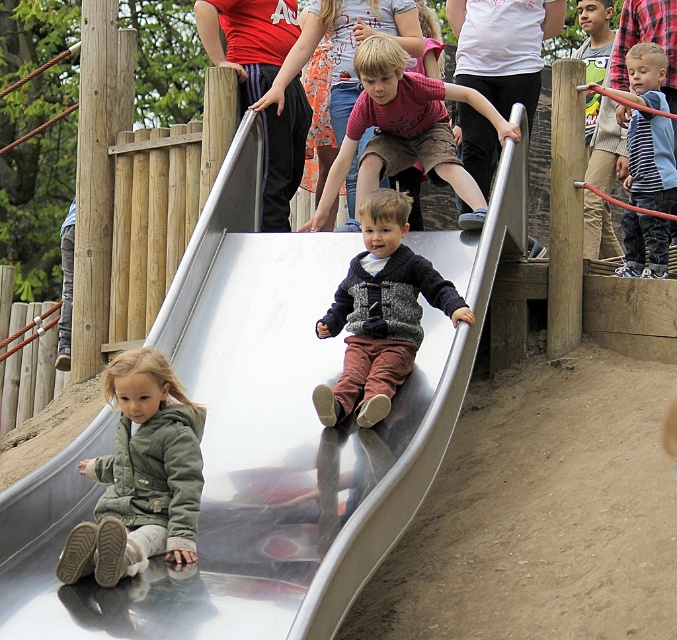
Which is in front, point (175, 496) or point (327, 392)?

Point (175, 496) is more forward.

Between green fleece jacket at lower left and knitted sweater at center, which one is positioned lower?

green fleece jacket at lower left is below.

The width and height of the screenshot is (677, 640). What are the coordinates of `green fleece jacket at lower left` in the screenshot? It's located at (139, 476).

Between metallic smooth slide at center and knitted sweater at center, which one has less height?

knitted sweater at center is shorter.

Who is more forward, (202, 545) or (374, 388)?

Point (202, 545) is more forward.

In order to click on metallic smooth slide at center in this screenshot , I will do `click(263, 435)`.

Is metallic smooth slide at center thinner than green fleece jacket at lower left?

No, metallic smooth slide at center is not thinner than green fleece jacket at lower left.

Is metallic smooth slide at center to the right of green fleece jacket at lower left from the viewer's perspective?

Yes, metallic smooth slide at center is to the right of green fleece jacket at lower left.

Locate an element on the screen. The height and width of the screenshot is (640, 677). metallic smooth slide at center is located at coordinates (263, 435).

The image size is (677, 640). I want to click on metallic smooth slide at center, so click(x=263, y=435).